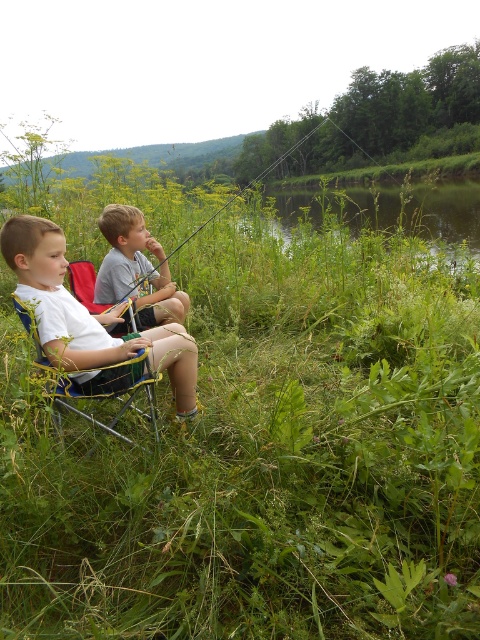
Does point (12, 412) come in front of point (51, 372)?

Yes, point (12, 412) is closer to viewer.

Can you confirm if green leafy grass at center is positioned above yellow fabric chair at center?

Indeed, green leafy grass at center is positioned over yellow fabric chair at center.

Find the location of a particular element. green leafy grass at center is located at coordinates (264, 452).

This screenshot has width=480, height=640. I want to click on green leafy grass at center, so [x=264, y=452].

Does yellow fabric chair at center appear over blue fabric chair at left?

Actually, yellow fabric chair at center is below blue fabric chair at left.

Based on the photo, which of these two, yellow fabric chair at center or blue fabric chair at left, stands shorter?

blue fabric chair at left is shorter.

Is point (111, 369) positioned in front of point (81, 280)?

Yes, point (111, 369) is in front of point (81, 280).

Locate an element on the screen. This screenshot has width=480, height=640. yellow fabric chair at center is located at coordinates (96, 388).

Is green leafy grass at center taller than white fabric shorts at lower left?

Correct, green leafy grass at center is much taller as white fabric shorts at lower left.

Which is more to the right, green leafy grass at center or white fabric shorts at lower left?

green leafy grass at center is more to the right.

Is point (264, 385) closer to camera compared to point (97, 380)?

No, (264, 385) is further to viewer.

The width and height of the screenshot is (480, 640). I want to click on green leafy grass at center, so click(x=264, y=452).